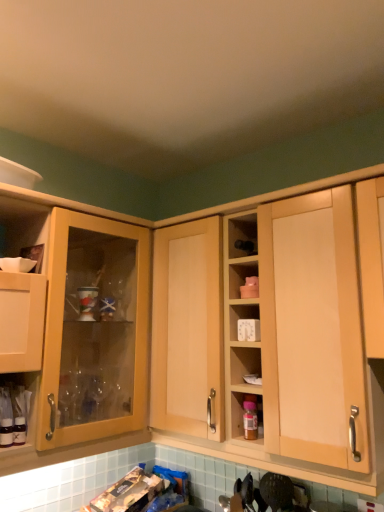
Question: Considering the relative sizes of matte wood cabinet at left, positioned as the 2th cabinetry in right-to-left order, and light wood cabinet at center, arranged as the second cabinetry when viewed from the left, in the image provided, is matte wood cabinet at left, positioned as the 2th cabinetry in right-to-left order, thinner than light wood cabinet at center, arranged as the second cabinetry when viewed from the left,?

Choices:
 (A) yes
 (B) no

Answer: (B)

Question: Can you confirm if matte wood cabinet at left, positioned as the first cabinetry in left-to-right order, is positioned to the right of light wood cabinet at center, which is the first cabinetry from right to left?

Choices:
 (A) yes
 (B) no

Answer: (B)

Question: Is matte wood cabinet at left, positioned as the first cabinetry in left-to-right order, positioned with its back to light wood cabinet at center, which is the first cabinetry from right to left?

Choices:
 (A) yes
 (B) no

Answer: (B)

Question: Is matte wood cabinet at left, positioned as the first cabinetry in left-to-right order, closer to camera compared to light wood cabinet at center, arranged as the second cabinetry when viewed from the left?

Choices:
 (A) no
 (B) yes

Answer: (A)

Question: Is matte wood cabinet at left, positioned as the 2th cabinetry in right-to-left order, shorter than light wood cabinet at center, which is the first cabinetry from right to left?

Choices:
 (A) yes
 (B) no

Answer: (B)

Question: Looking at the image, does translucent plastic bottle at center-right seem bigger or smaller compared to matte wood cabinet at left, positioned as the first cabinetry in left-to-right order?

Choices:
 (A) big
 (B) small

Answer: (B)

Question: Does point (243, 406) appear closer or farther from the camera than point (56, 403)?

Choices:
 (A) farther
 (B) closer

Answer: (A)

Question: Is translucent plastic bottle at center-right wider or thinner than matte wood cabinet at left, positioned as the 2th cabinetry in right-to-left order?

Choices:
 (A) wide
 (B) thin

Answer: (B)

Question: Considering the relative positions of translucent plastic bottle at center-right and matte wood cabinet at left, positioned as the 2th cabinetry in right-to-left order, in the image provided, is translucent plastic bottle at center-right to the left or to the right of matte wood cabinet at left, positioned as the 2th cabinetry in right-to-left order,?

Choices:
 (A) right
 (B) left

Answer: (A)

Question: From their relative heights in the image, would you say light wood cabinet at center, arranged as the second cabinetry when viewed from the left, is taller or shorter than translucent plastic bottle at center-right?

Choices:
 (A) short
 (B) tall

Answer: (B)

Question: Considering the positions of light wood cabinet at center, arranged as the second cabinetry when viewed from the left, and translucent plastic bottle at center-right in the image, is light wood cabinet at center, arranged as the second cabinetry when viewed from the left, bigger or smaller than translucent plastic bottle at center-right?

Choices:
 (A) big
 (B) small

Answer: (A)

Question: Considering the positions of light wood cabinet at center, arranged as the second cabinetry when viewed from the left, and translucent plastic bottle at center-right in the image, is light wood cabinet at center, arranged as the second cabinetry when viewed from the left, wider or thinner than translucent plastic bottle at center-right?

Choices:
 (A) wide
 (B) thin

Answer: (A)

Question: Would you say light wood cabinet at center, arranged as the second cabinetry when viewed from the left, is inside or outside translucent plastic bottle at center-right?

Choices:
 (A) inside
 (B) outside

Answer: (B)

Question: Which is correct: translucent glass bottles at lower left is inside translucent plastic bottle at center-right, or outside of it?

Choices:
 (A) outside
 (B) inside

Answer: (A)

Question: Is translucent glass bottles at lower left in front of or behind translucent plastic bottle at center-right in the image?

Choices:
 (A) behind
 (B) front

Answer: (B)